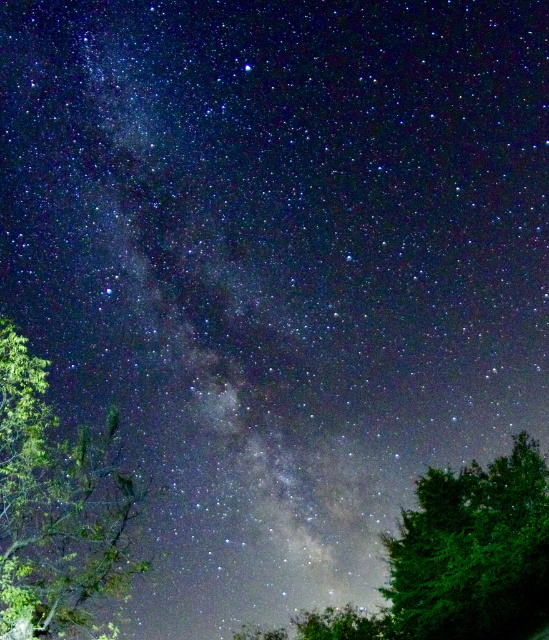
Can you confirm if green leafy tree at lower left is thinner than green leafy tree at lower right?

Yes, green leafy tree at lower left is thinner than green leafy tree at lower right.

Is point (99, 576) less distant than point (466, 531)?

Yes, point (99, 576) is closer to viewer.

At what (x,y) coordinates should I click in order to perform the action: click on green leafy tree at lower left. Please return your answer as a coordinate pair (x, y). Image resolution: width=549 pixels, height=640 pixels. Looking at the image, I should click on (55, 502).

Image resolution: width=549 pixels, height=640 pixels. Find the location of `green leafy tree at lower left`. green leafy tree at lower left is located at coordinates (55, 502).